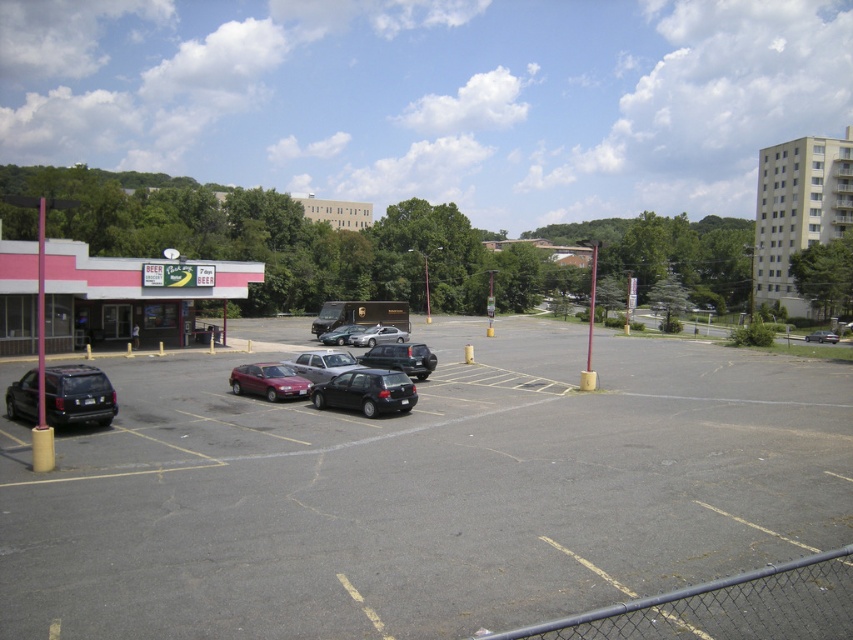
You are driving a car that is 4 meters long. You want to park in the dark gray asphalt parking lot at center. The parking space there is as wide as the shiny black sedan at center. Can your car fit into that parking space?

The dark gray asphalt parking lot at center is wider than the shiny black sedan at center. Since the parking space is as wide as the sedan, your car can fit as long as the length of the parking space accommodates your car. However, the question specifies width, so if the parking space width matches the sedan, and your car is 4 meters long, the width might not be an issue, but length isn

From the picture: You are standing at the entrance of the store and want to park your car in the parking lot. You see a black matte hatchback at center and a matte black van at center. Which vehicle is positioned to the right of the other?

The black matte hatchback at center is to the right of the matte black van at center.

Looking at this image, you are a delivery driver who needs to park your vehicle in the parking lot. You have a black matte hatchback at center and a matte black van at center. Which vehicle will require more space to park?

The black matte hatchback at center is larger in size than the matte black van at center, so it will require more space to park.